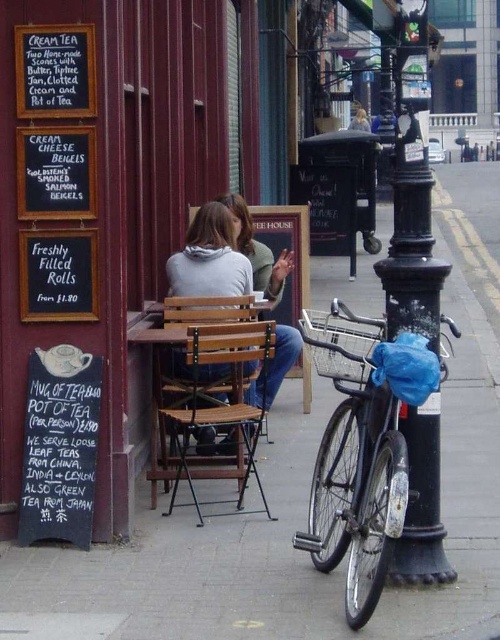
Question: Does black matte bicycle at right have a greater width compared to wooden bench at center?

Choices:
 (A) no
 (B) yes

Answer: (A)

Question: Among these objects, which one is nearest to the camera?

Choices:
 (A) wooden bench at center
 (B) matte gray hoodie at center
 (C) black metal pole at right
 (D) white chalkboard at lower left

Answer: (C)

Question: Which point is closer to the camera?

Choices:
 (A) black metal pole at right
 (B) white chalkboard at lower left

Answer: (A)

Question: Which point is closer to the camera?

Choices:
 (A) black matte bicycle at right
 (B) wooden bench at center
 (C) white chalkboard at lower left
 (D) black metal pole at right

Answer: (A)

Question: Is white chalkboard at lower left positioned behind wooden bench at center?

Choices:
 (A) no
 (B) yes

Answer: (A)

Question: Is white chalkboard at lower left bigger than matte gray hoodie at center?

Choices:
 (A) yes
 (B) no

Answer: (B)